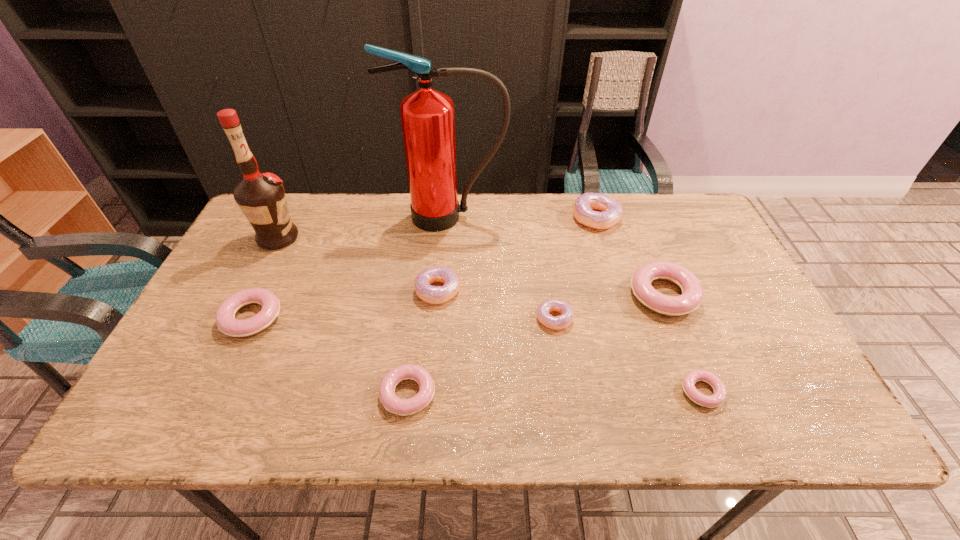
Where is `vacant space located 0.100m on the back of the sixth object from left to right`? vacant space located 0.100m on the back of the sixth object from left to right is located at coordinates [x=548, y=278].

This screenshot has width=960, height=540. What are the coordinates of `free space located on the back of the second pink doughnut from left to right` in the screenshot? It's located at (418, 323).

In order to click on free space located on the back of the smallest pink doughnut in this screenshot , I will do `click(665, 299)`.

Where is `fire extinguisher located at the far edge`? This screenshot has width=960, height=540. fire extinguisher located at the far edge is located at coordinates pyautogui.click(x=427, y=116).

What are the coordinates of `liquor that is at the far edge` in the screenshot? It's located at click(x=261, y=197).

Find the location of a particular element. Image resolution: width=960 pixels, height=540 pixels. doughnut that is positioned at the far edge is located at coordinates (584, 205).

The width and height of the screenshot is (960, 540). Find the location of `liquor positioned at the left edge`. liquor positioned at the left edge is located at coordinates (261, 197).

This screenshot has width=960, height=540. Find the location of `doughnut that is at the left edge`. doughnut that is at the left edge is located at coordinates (225, 316).

What are the coordinates of `object at the right edge` in the screenshot? It's located at (692, 292).

Locate an element on the screen. Image resolution: width=960 pixels, height=540 pixels. object that is at the far left corner is located at coordinates (261, 197).